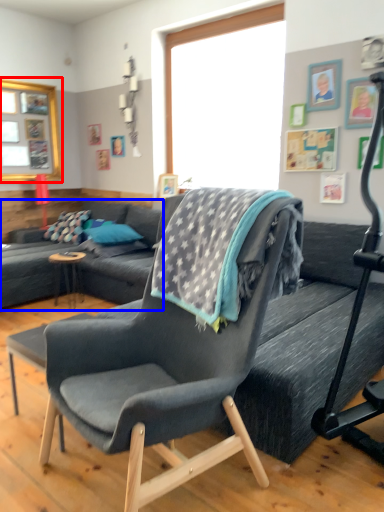
Question: Which of the following is the closest to the observer, window screen (highlighted by a red box) or studio couch (highlighted by a blue box)?

Choices:
 (A) window screen
 (B) studio couch

Answer: (B)